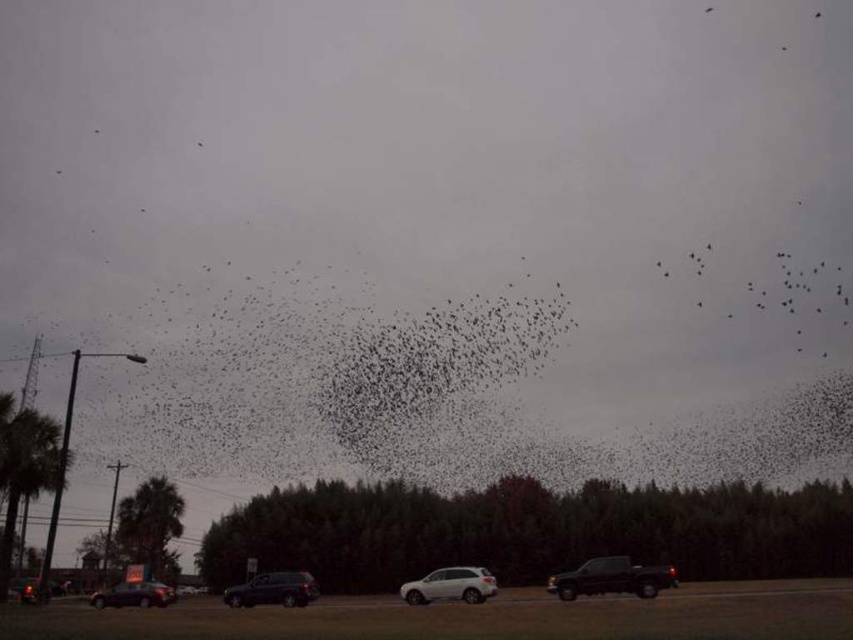
Is point (453, 584) positioned before point (300, 602)?

Yes, it is.

Does point (480, 570) come farther from viewer compared to point (234, 600)?

No.

The width and height of the screenshot is (853, 640). What do you see at coordinates (450, 586) in the screenshot?
I see `white matte suv at center` at bounding box center [450, 586].

Locate an element on the screen. This screenshot has width=853, height=640. white matte suv at center is located at coordinates (450, 586).

I want to click on black matte truck at lower right, so click(611, 579).

Which is more to the left, black matte truck at lower right or shiny black suv at center?

From the viewer's perspective, shiny black suv at center appears more on the left side.

Which is in front, point (616, 564) or point (263, 579)?

Point (616, 564) is in front.

At what (x,y) coordinates should I click in order to perform the action: click on black matte truck at lower right. Please return your answer as a coordinate pair (x, y). Image resolution: width=853 pixels, height=640 pixels. Looking at the image, I should click on (611, 579).

What do you see at coordinates (611, 579) in the screenshot? I see `black matte truck at lower right` at bounding box center [611, 579].

Locate an element on the screen. black matte truck at lower right is located at coordinates (611, 579).